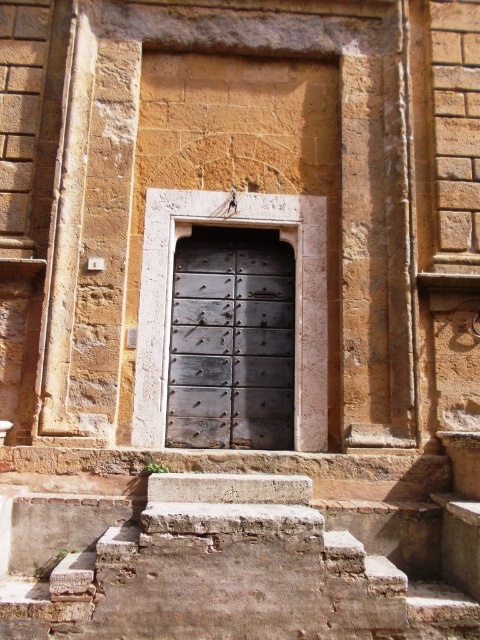
Measure the distance between rusty stone stairs at lower center and rusty metal door at center.

rusty stone stairs at lower center and rusty metal door at center are 7.67 feet apart from each other.

Does rusty stone stairs at lower center appear under rusty metal door at center?

Correct, rusty stone stairs at lower center is located below rusty metal door at center.

Identify the location of rusty stone stairs at lower center. The height and width of the screenshot is (640, 480). (217, 570).